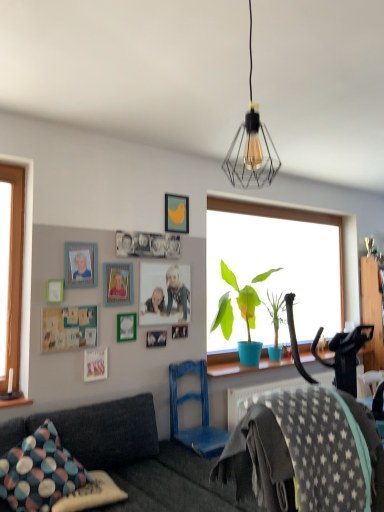
Question: From a real-world perspective, relative to wooden photo frame at center, placed as the 8th picture frame when sorted from top to bottom, is gray star-patterned fabric at lower right vertically above or below?

Choices:
 (A) above
 (B) below

Answer: (B)

Question: Is gray star-patterned fabric at lower right inside the boundaries of wooden photo frame at center, which is the 3th picture frame in bottom-to-top order, or outside?

Choices:
 (A) outside
 (B) inside

Answer: (A)

Question: Which object is the closest to the polka dot fabric pillow at lower left, arranged as the second pillow when viewed from the top?

Choices:
 (A) blue painted wood swivel chair at lower center
 (B) green matte picture frame at lower left, the 5th picture frame positioned from the bottom
 (C) matte black wire cage at upper center
 (D) yellow matte picture frame at upper center, which is the tenth picture frame from bottom to top
 (E) dark gray fabric couch at lower left

Answer: (E)

Question: Based on their relative distances, which object is farther from the multicolored fabric pillow at lower left, the first pillow viewed from the top?

Choices:
 (A) wooden dresser at right
 (B) polka dot fabric pillow at lower left, arranged as the second pillow when viewed from the top
 (C) matte black wire cage at upper center
 (D) blue matte plant pot at window
 (E) wooden photo frame at center, placed as the 8th picture frame when sorted from top to bottom

Answer: (A)